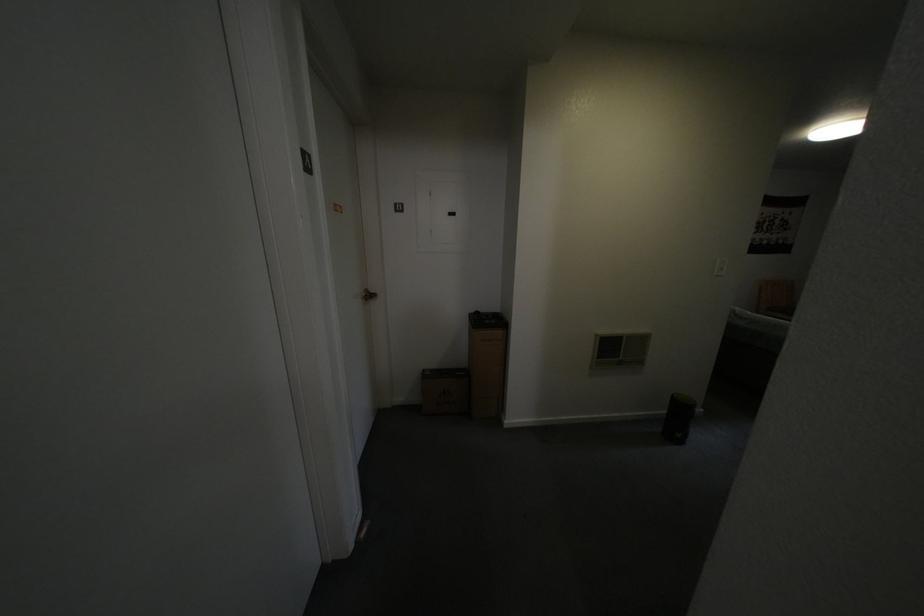
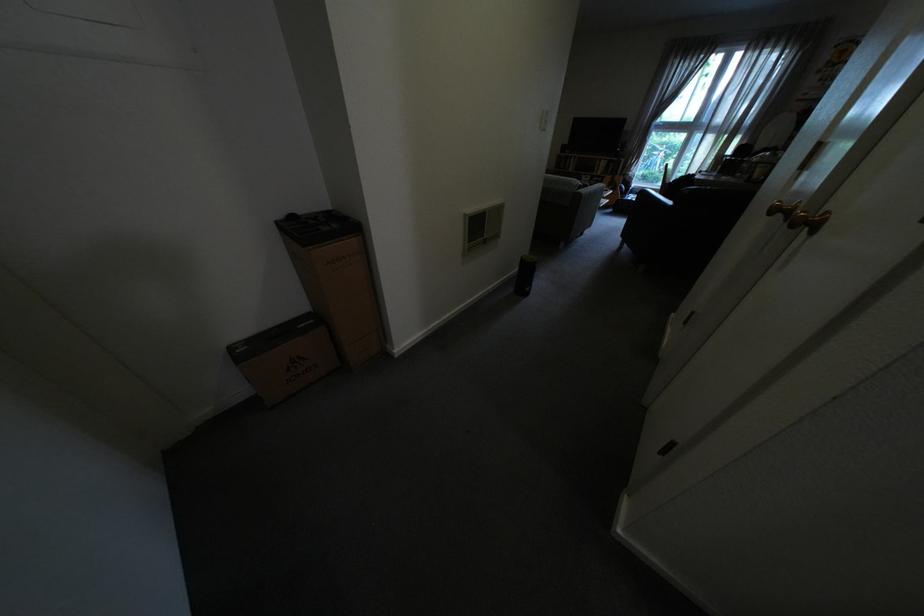
The first image is from the beginning of the video and the second image is from the end. How did the camera likely rotate when shooting the video?

The camera's rotation is toward right-down.